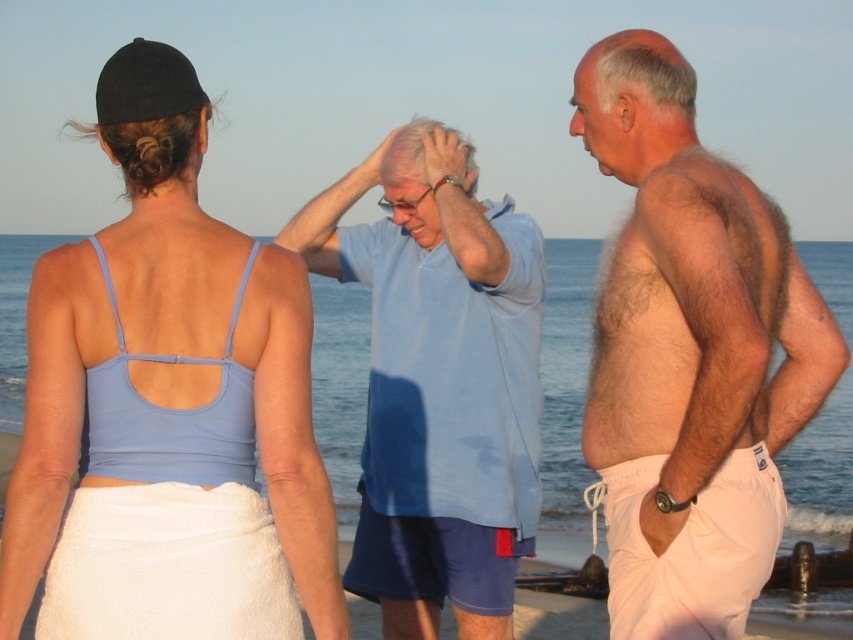
Based on the scene description, which object is positioned to the right of the other between the beige cotton shorts at right and the light blue cotton shirt at center?

The beige cotton shorts at right is positioned to the right of the light blue cotton shirt at center according to the description.

You are a photographer trying to capture a candid shot of the two beachgoers wearing the matte blue tank top at center and the beige cotton shorts at right. Since you want to include both in the frame, where should you position yourself relative to them?

You should position yourself to the right of both the matte blue tank top at center and the beige cotton shorts at right because the matte blue tank top at center is to the left of the beige cotton shorts at right, so standing to their right would allow you to capture both in the frame.

Based on the scene description, which object is larger in size between the beige cotton shorts at right and the light blue cotton shirt at center?

The beige cotton shorts at right is larger in size compared to the light blue cotton shirt at center according to the description.